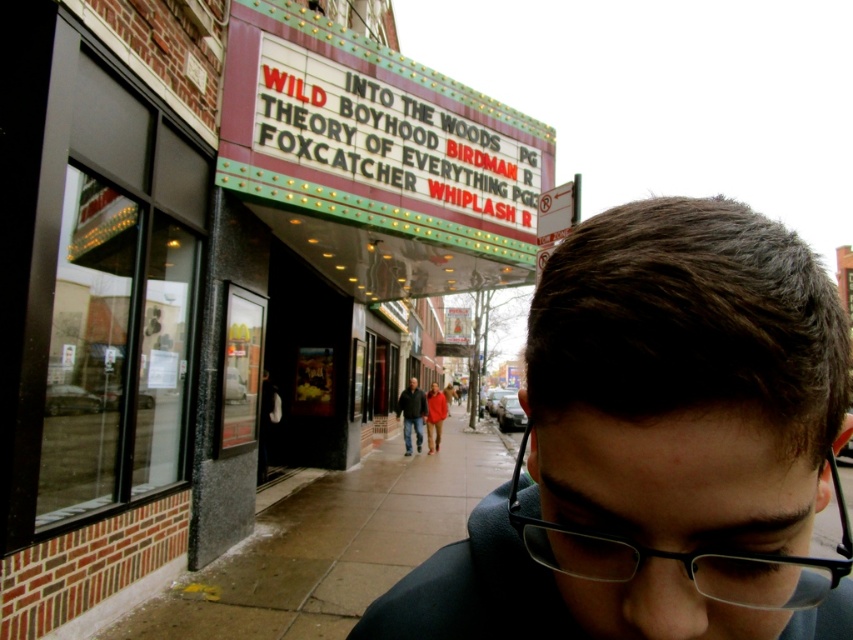
You are standing in front of the movie theater and notice the brick facade at center. Can you determine its exact location on the image using the coordinate provided?

The brick facade at center is located at point (218,268).

You are standing in front of the movie theater marquee and notice two points marked on it. The first point is at coordinates point (405, 138) and the second is at point (421, 424). Which point do you think is closer to you?

Point (405, 138) is closer to the viewer than point (421, 424).

You are at the movie theater and want to pick up your belongings before the movie starts. You see the black plastic glasses at center and the dark gray jacket at center. Which one is closer to you?

The black plastic glasses at center is above the dark gray jacket at center, so the dark gray jacket at center is closer to you.